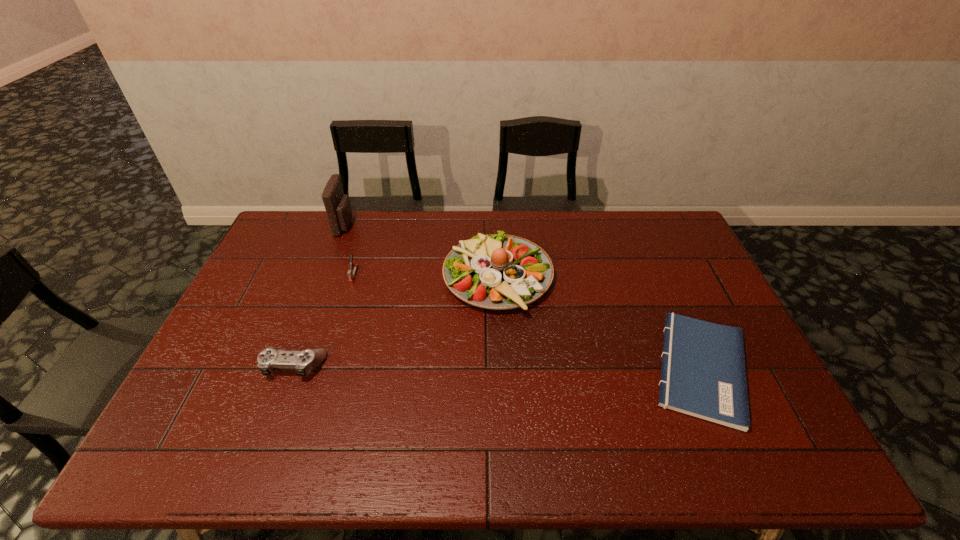
Identify the location of vacant space at the near edge. (249, 462).

In the image, there is a desktop. Identify the location of vacant space at the left edge. This screenshot has height=540, width=960. (195, 384).

In the image, there is a desktop. Find the location of `free space at the right edge`. free space at the right edge is located at coordinates (761, 395).

Where is `vacant region at the far left corner of the desktop`? This screenshot has height=540, width=960. vacant region at the far left corner of the desktop is located at coordinates (287, 220).

Where is `free space at the far right corner of the desktop`? The height and width of the screenshot is (540, 960). free space at the far right corner of the desktop is located at coordinates (675, 223).

Where is `empty location between the stapler and the rightmost object`? empty location between the stapler and the rightmost object is located at coordinates (527, 321).

Find the location of a particular element. This screenshot has width=960, height=540. unoccupied area between the stapler and the control is located at coordinates (324, 320).

Image resolution: width=960 pixels, height=540 pixels. What are the coordinates of `unoccupied area between the tallest object and the control` in the screenshot? It's located at (320, 296).

This screenshot has height=540, width=960. Find the location of `vacant region between the second shortest object and the tallest object`. vacant region between the second shortest object and the tallest object is located at coordinates (320, 296).

Find the location of a particular element. free space that is in between the rightmost object and the third tallest object is located at coordinates (527, 321).